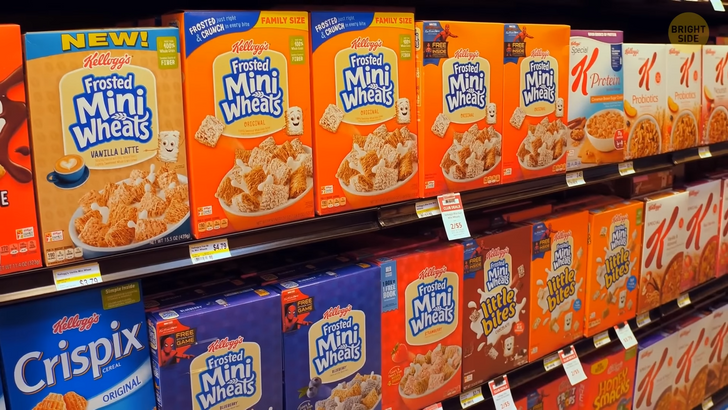
Find the location of a particular element. The image size is (728, 410). cereals on the top shelf is located at coordinates (1, 193), (76, 172), (240, 143), (343, 137), (455, 120), (537, 117), (601, 112), (641, 109), (678, 103), (711, 102).